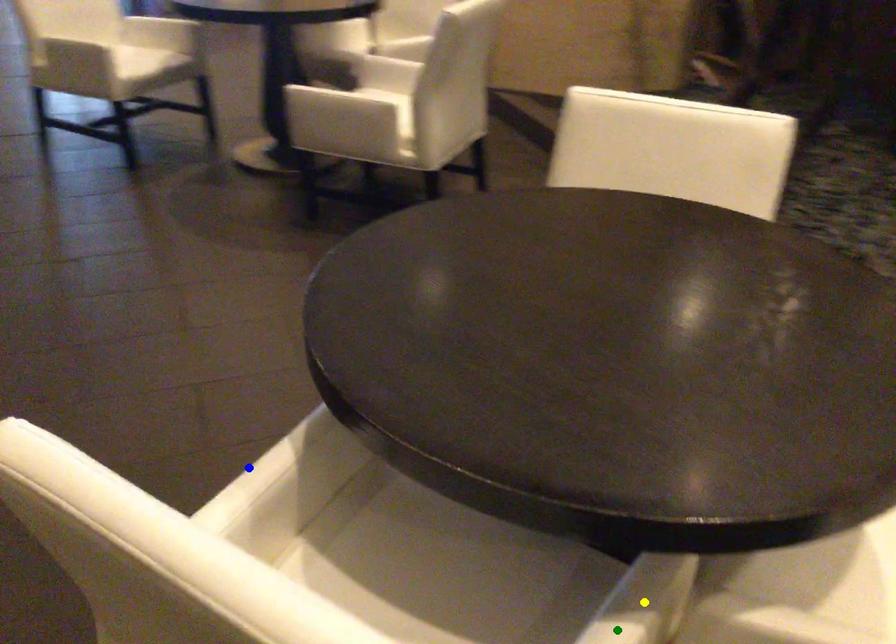
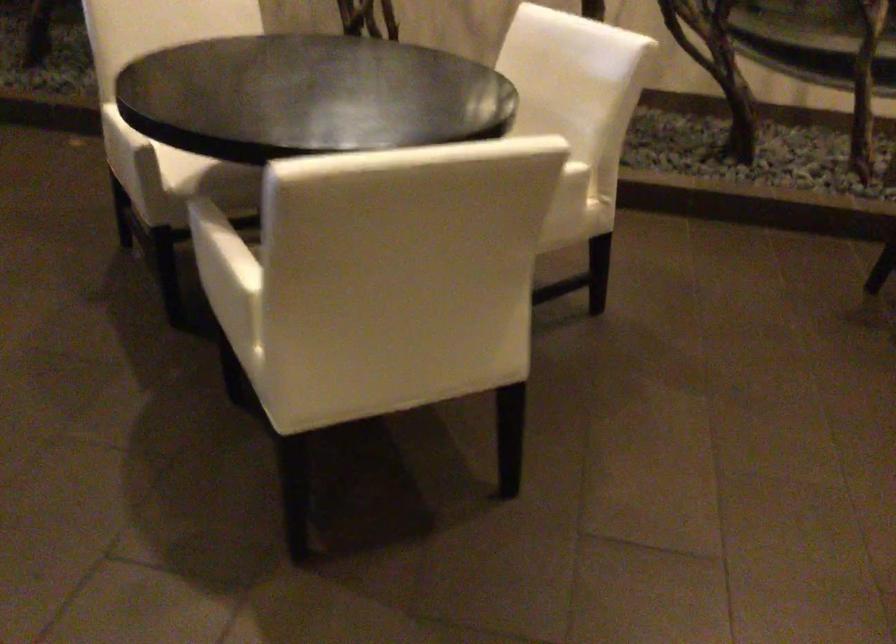
I am providing you with two images of the same scene from different viewpoints. Three points are marked in image1. Which point corresponds to a part or object that is occluded in image2?In image1, three points are marked. Which of them correspond to a part or object that is occluded in image2?Among the three points shown in image1, which one corresponds to a part or object that is no longer visible due to occlusion in image2?

Invisible in image2: yellow point, green point.